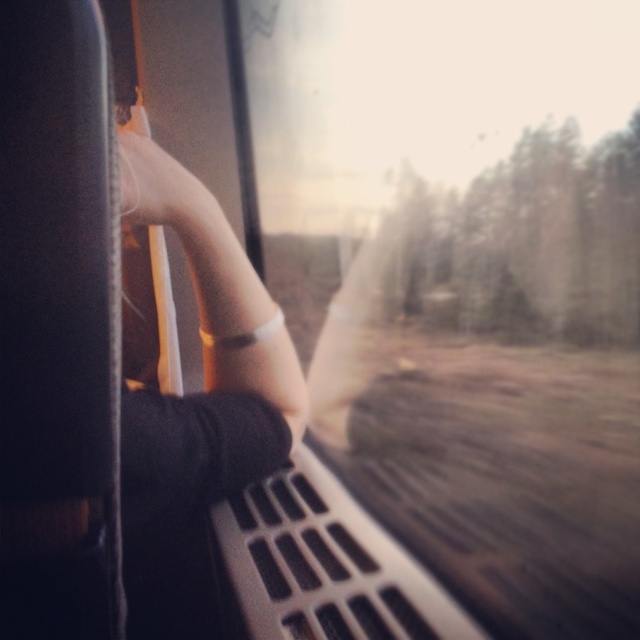
Question: Which object appears closest to the camera in this image?

Choices:
 (A) matte white hand at upper left
 (B) transparent glass train window at center

Answer: (A)

Question: Does transparent glass train window at center have a larger size compared to matte white hand at upper left?

Choices:
 (A) no
 (B) yes

Answer: (B)

Question: Does transparent glass train window at center have a smaller size compared to matte white hand at upper left?

Choices:
 (A) yes
 (B) no

Answer: (B)

Question: Is transparent glass train window at center behind matte white hand at upper left?

Choices:
 (A) no
 (B) yes

Answer: (B)